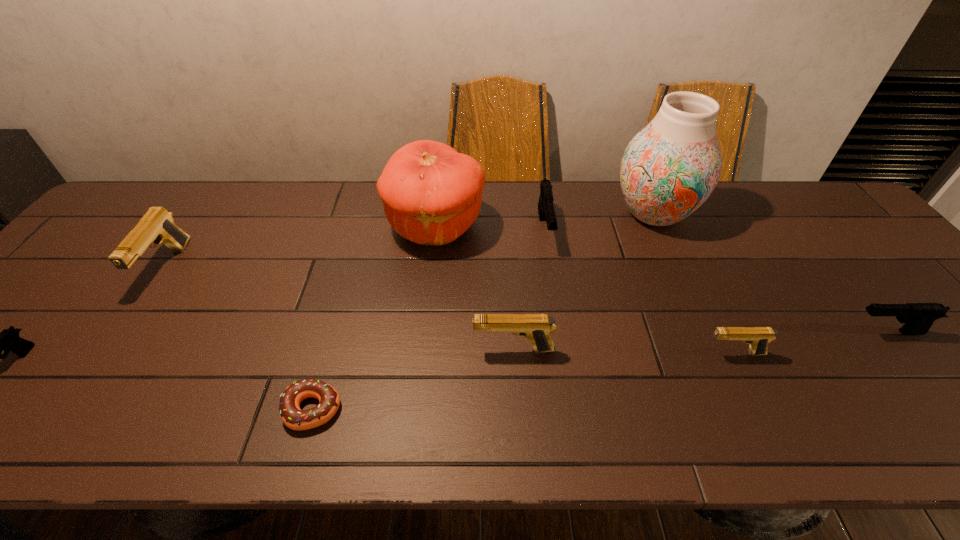
Locate an element on the screen. Image resolution: width=960 pixels, height=540 pixels. vase is located at coordinates (668, 170).

Where is `pumpkin`? The height and width of the screenshot is (540, 960). pumpkin is located at coordinates (431, 194).

The image size is (960, 540). I want to click on the leftmost tan pistol, so click(157, 225).

Identify the location of the fifth pistol from right to left. (157, 225).

You are a GUI agent. You are given a task and a screenshot of the screen. Output one action in this format:
    pyautogui.click(x=<x>, y=<y>)
    Task: Click on the fourth object from right to left
    The image size is (960, 540).
    Given the screenshot: What is the action you would take?
    pyautogui.click(x=546, y=211)

This screenshot has width=960, height=540. What are the coordinates of `the second black pistol from left to right` in the screenshot? It's located at (546, 211).

This screenshot has width=960, height=540. What are the coordinates of `the third pistol from left to right` in the screenshot? It's located at coord(536,327).

This screenshot has height=540, width=960. I want to click on the second tan pistol from left to right, so click(536, 327).

Where is `the fourth nearest pistol`? The height and width of the screenshot is (540, 960). the fourth nearest pistol is located at coordinates (917, 318).

Identify the location of the second nearest black pistol. This screenshot has width=960, height=540. (917, 318).